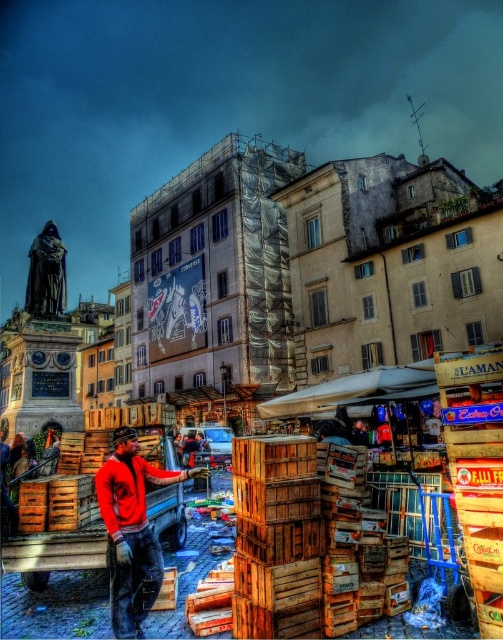
Question: Observing the image, what is the correct spatial positioning of wooden crates at center in reference to smooth dark statue at upper left?

Choices:
 (A) right
 (B) left

Answer: (A)

Question: Which of these objects is positioned farthest from the red sweater at center?

Choices:
 (A) wooden crates at center
 (B) smooth dark statue at upper left

Answer: (B)

Question: Which point is closer to the camera?

Choices:
 (A) wooden crates at lower left
 (B) red sweater at center
 (C) wooden crates at center

Answer: (C)

Question: Can you confirm if wooden crates at center is bigger than smooth dark statue at upper left?

Choices:
 (A) no
 (B) yes

Answer: (B)

Question: Which point is farther to the camera?

Choices:
 (A) red sweater at center
 (B) wooden crates at lower left

Answer: (B)

Question: Does wooden crates at center appear under wooden crates at lower left?

Choices:
 (A) no
 (B) yes

Answer: (A)